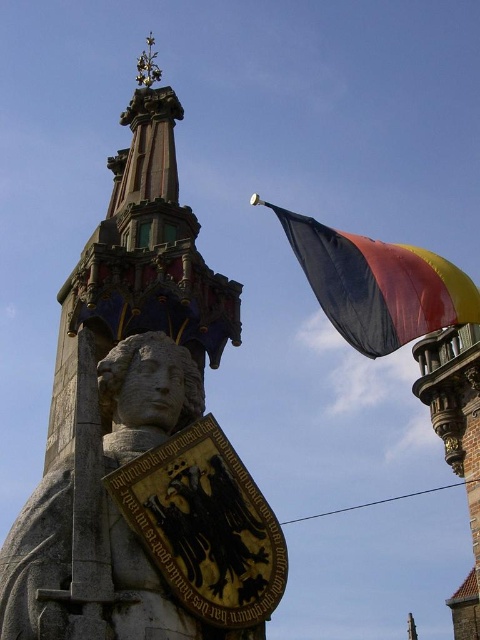
Question: Can you confirm if stone statue at center is positioned to the left of polyester flag at upper right?

Choices:
 (A) no
 (B) yes

Answer: (B)

Question: Does stone statue at center lie in front of polyester flag at upper right?

Choices:
 (A) yes
 (B) no

Answer: (A)

Question: Among these objects, which one is farthest from the camera?

Choices:
 (A) polyester flag at upper right
 (B) stone statue at center

Answer: (A)

Question: Can you confirm if stone statue at center is thinner than polyester flag at upper right?

Choices:
 (A) no
 (B) yes

Answer: (B)

Question: Among these objects, which one is nearest to the camera?

Choices:
 (A) polyester flag at upper right
 (B) stone statue at center

Answer: (B)